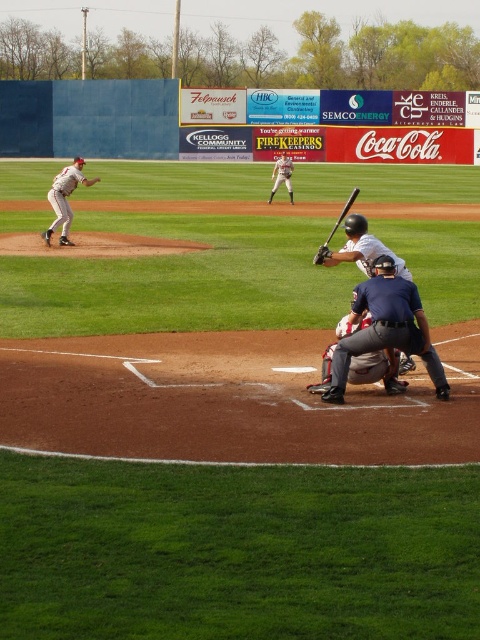
You are a coach observing the baseball game and need to determine which object is wider between the white matte baseball bat at center and the brown leather glove at center. Based on the scene, which one is wider?

The white matte baseball bat at center is wider than the brown leather glove at center.

You are a photographer at the baseball field. You need to position your camera at the point marked by the coordinates point (x=385, y=328). What object will be directly in front of your camera?

The point (x=385, y=328) marks the dark blue uniform at center, so the dark blue uniform at center will be directly in front of the camera.

You are a spectator at the baseball game and notice two gloves in the image. Which glove is positioned to the left when comparing the silver metallic baseball glove at upper center and the brown leather glove at lower center?

The silver metallic baseball glove at upper center is positioned to the left of the brown leather glove at lower center.